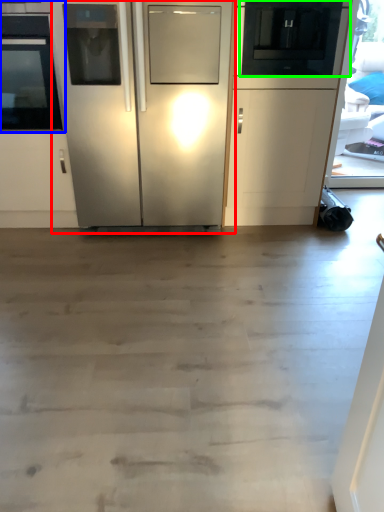
Question: Considering the real-world distances, which object is closest to refrigerator (highlighted by a red box)? oven (highlighted by a blue box) or appliance (highlighted by a green box).

Choices:
 (A) oven
 (B) appliance

Answer: (A)